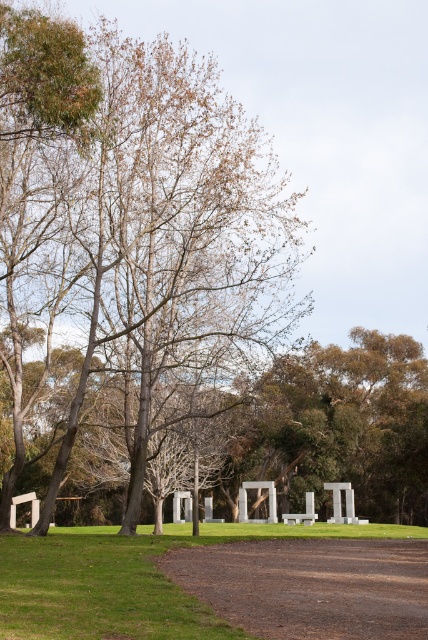
You are standing at the starting point of the dirt path in the foreground of the image. You want to reach the brown leafy tree at center. What direction should you walk to reach it?

The brown leafy tree at center is located at point coordinates of (130, 237). Since you are at the starting point of the dirt path in the foreground, you should walk towards the center of the image where the tree is positioned.

You are standing at the point marked by the coordinates point (x=130, y=237). Looking around, you see a brown leafy tree at center. Which direction should you face to see the tree?

The brown leafy tree at center is represented by point (x=130, y=237), so you are already at the location of the tree. Therefore, you cannot see the tree from where you are standing.